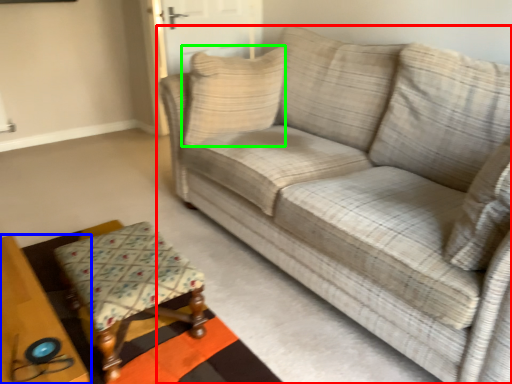
Question: Which object is the farthest from studio couch (highlighted by a red box)? Choose among these: table (highlighted by a blue box) or pillow (highlighted by a green box).

Choices:
 (A) table
 (B) pillow

Answer: (A)